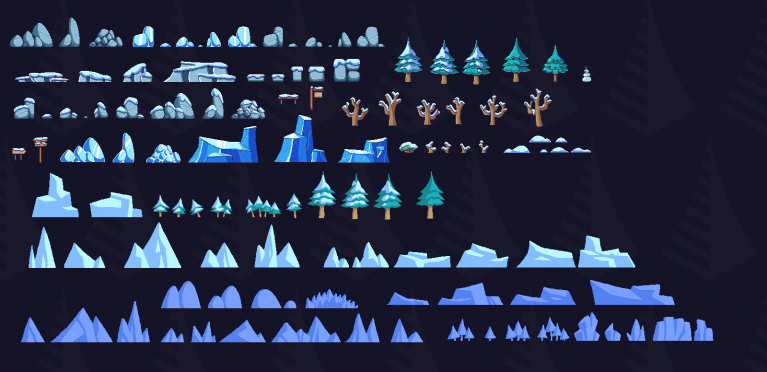
Find the location of `christmas trees with snow`. christmas trees with snow is located at coordinates (163, 213), (178, 205), (193, 209), (224, 206), (259, 209), (295, 206), (313, 200), (353, 201), (389, 201), (446, 206).